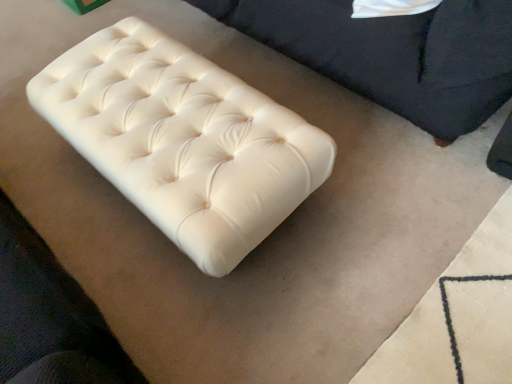
Question: Is white leather ottoman at center, marked as the 1th furniture in a left-to-right arrangement, at the back of white leather ottoman at upper right, which is the first furniture in right-to-left order?

Choices:
 (A) no
 (B) yes

Answer: (A)

Question: Is white leather ottoman at upper right, the 2th furniture from the left, smaller than white leather ottoman at center, which appears as the 2th furniture when viewed from the right?

Choices:
 (A) no
 (B) yes

Answer: (B)

Question: Is white leather ottoman at upper right, which is the first furniture in right-to-left order, at the left side of white leather ottoman at center, which appears as the 2th furniture when viewed from the right?

Choices:
 (A) yes
 (B) no

Answer: (B)

Question: Considering the relative positions of white leather ottoman at upper right, which is the first furniture in right-to-left order, and white leather ottoman at center, which appears as the 2th furniture when viewed from the right, in the image provided, is white leather ottoman at upper right, which is the first furniture in right-to-left order, to the right of white leather ottoman at center, which appears as the 2th furniture when viewed from the right, from the viewer's perspective?

Choices:
 (A) yes
 (B) no

Answer: (A)

Question: Is white leather ottoman at upper right, which is the first furniture in right-to-left order, wider than white leather ottoman at center, marked as the 1th furniture in a left-to-right arrangement?

Choices:
 (A) no
 (B) yes

Answer: (A)

Question: Considering the relative positions of white leather ottoman at upper right, which is the first furniture in right-to-left order, and white leather ottoman at center, which appears as the 2th furniture when viewed from the right, in the image provided, is white leather ottoman at upper right, which is the first furniture in right-to-left order, behind white leather ottoman at center, which appears as the 2th furniture when viewed from the right,?

Choices:
 (A) yes
 (B) no

Answer: (B)

Question: Is white leather ottoman at center, marked as the 1th furniture in a left-to-right arrangement, completely or partially outside of white leather ottoman at upper right, which is the first furniture in right-to-left order?

Choices:
 (A) yes
 (B) no

Answer: (A)

Question: Is white leather ottoman at upper right, which is the first furniture in right-to-left order, at the back of white leather ottoman at center, marked as the 1th furniture in a left-to-right arrangement?

Choices:
 (A) yes
 (B) no

Answer: (B)

Question: From the image's perspective, does white leather ottoman at center, which appears as the 2th furniture when viewed from the right, appear lower than white leather ottoman at upper right, the 2th furniture from the left?

Choices:
 (A) yes
 (B) no

Answer: (A)

Question: From a real-world perspective, is white leather ottoman at center, which appears as the 2th furniture when viewed from the right, positioned over white leather ottoman at upper right, which is the first furniture in right-to-left order, based on gravity?

Choices:
 (A) no
 (B) yes

Answer: (A)

Question: Is there a large distance between white leather ottoman at center, which appears as the 2th furniture when viewed from the right, and white leather ottoman at upper right, the 2th furniture from the left?

Choices:
 (A) no
 (B) yes

Answer: (A)

Question: Does white leather ottoman at center, marked as the 1th furniture in a left-to-right arrangement, come in front of white leather ottoman at upper right, the 2th furniture from the left?

Choices:
 (A) no
 (B) yes

Answer: (A)

Question: From a real-world perspective, is white leather ottoman at center, which appears as the 2th furniture when viewed from the right, positioned above or below white leather ottoman at upper right, the 2th furniture from the left?

Choices:
 (A) above
 (B) below

Answer: (B)